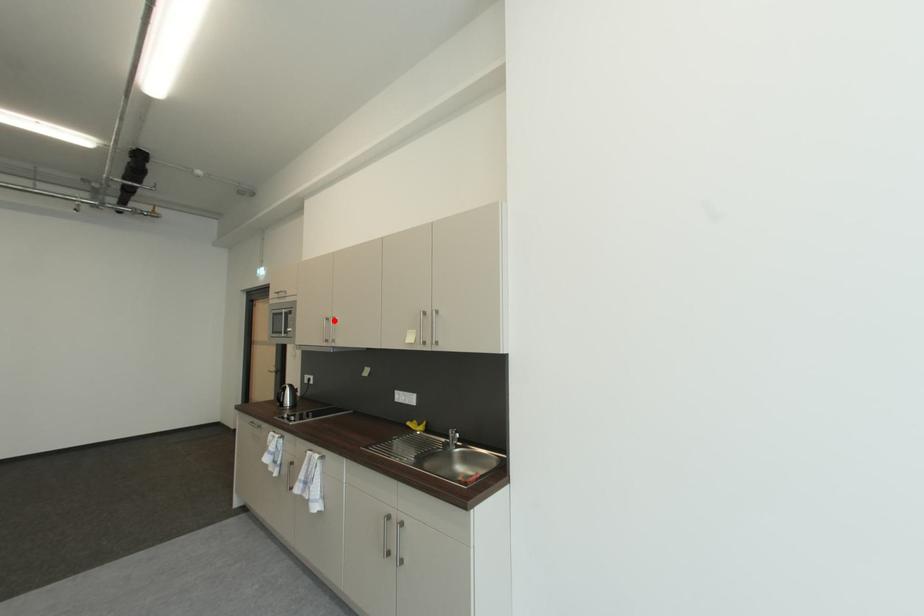
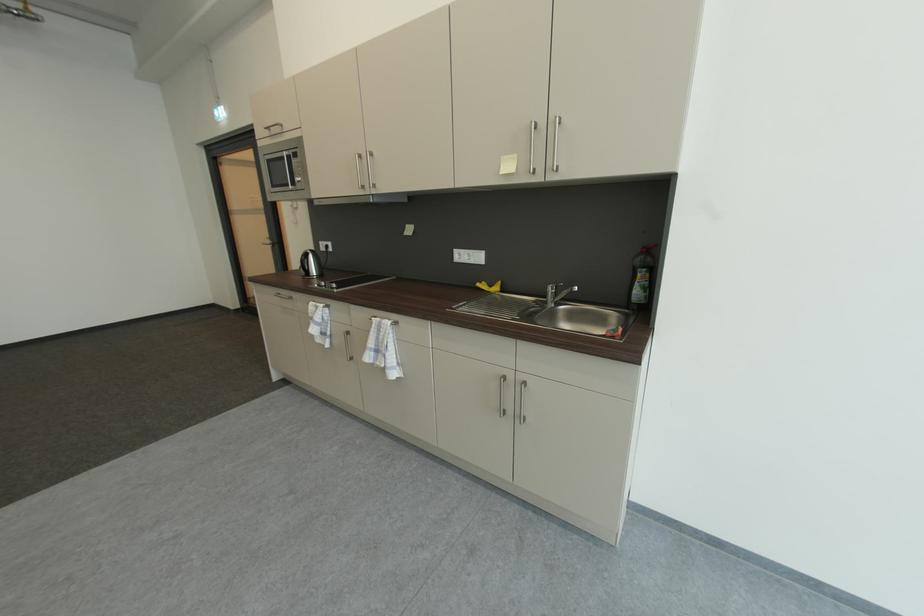
Question: A red point is marked in image1. In image2, is the corresponding 3D point closer to the camera or farther? Reply with the corresponding letter.

Choices:
 (A) The corresponding 3D point is closer.
 (B) The corresponding 3D point is farther.

Answer: (A)